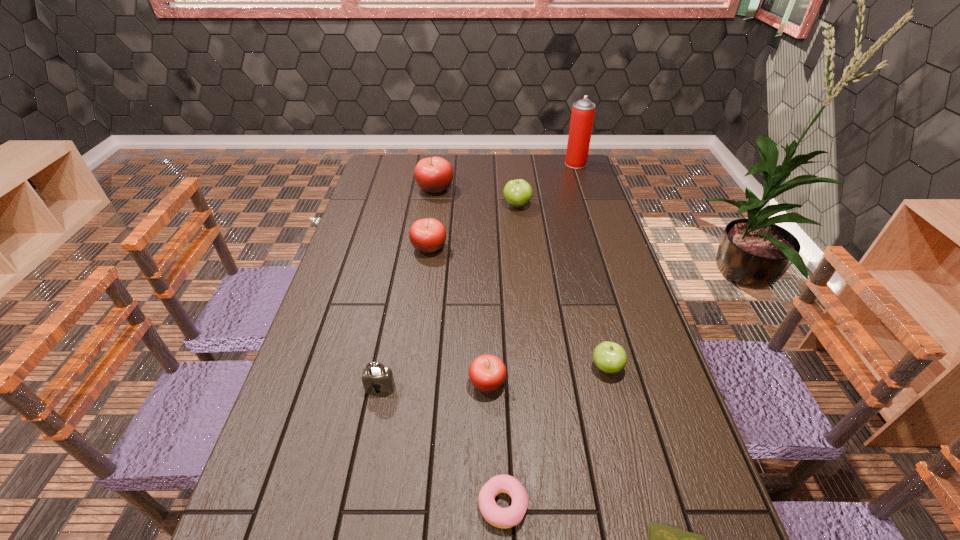
In the image, there is a desktop. What are the coordinates of `vacant space at the right edge` in the screenshot? It's located at (585, 186).

Where is `vacant area between the third farthest apple and the pink doughnut`? vacant area between the third farthest apple and the pink doughnut is located at coordinates [467, 376].

Identify the location of vacant point located between the left green apple and the padlock. (448, 296).

I want to click on empty space that is in between the second nearest red apple and the doughnut, so click(467, 376).

At what (x,y) coordinates should I click in order to perform the action: click on vacant space in between the padlock and the fourth farthest object. Please return your answer as a coordinate pair (x, y). Image resolution: width=960 pixels, height=540 pixels. Looking at the image, I should click on (404, 318).

This screenshot has width=960, height=540. Find the location of `free point between the tallest object and the rightmost red apple`. free point between the tallest object and the rightmost red apple is located at coordinates (532, 273).

Where is `empty space between the padlock and the fourth apple from left to right`? This screenshot has height=540, width=960. empty space between the padlock and the fourth apple from left to right is located at coordinates (448, 296).

Locate an element on the screen. This screenshot has height=540, width=960. free space between the nearest red apple and the bigger green apple is located at coordinates (502, 294).

The width and height of the screenshot is (960, 540). What are the coordinates of `unoccupied position between the padlock and the smallest red apple` in the screenshot? It's located at (434, 385).

Image resolution: width=960 pixels, height=540 pixels. In order to click on unoccupied position between the eighth shortest object and the padlock in this screenshot , I will do `click(408, 288)`.